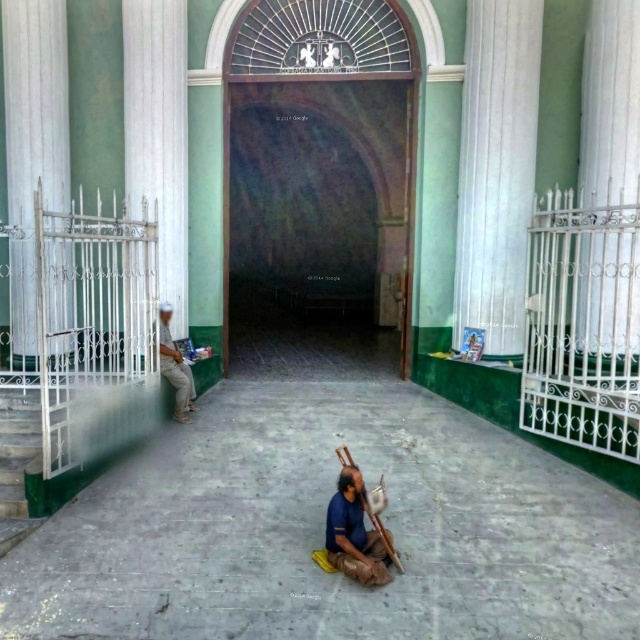
Question: Is white smooth pillar at right below white metal gate at left?

Choices:
 (A) yes
 (B) no

Answer: (A)

Question: Which of the following is the farthest from the observer?

Choices:
 (A) (168, 336)
 (B) (180, 180)
 (C) (586, 269)

Answer: (B)

Question: Which of the following is the farthest from the observer?

Choices:
 (A) (177, 410)
 (B) (38, 1)
 (C) (618, 60)

Answer: (B)

Question: Estimate the real-world distances between objects in this image. Which object is farther from the white smooth pillar at right?

Choices:
 (A) light beige pants at left
 (B) brown leather bag at center

Answer: (B)

Question: Can you confirm if white metal gate at left is smaller than brown leather bag at center?

Choices:
 (A) no
 (B) yes

Answer: (A)

Question: Does white smooth pillar at right come in front of brown leather bag at center?

Choices:
 (A) no
 (B) yes

Answer: (A)